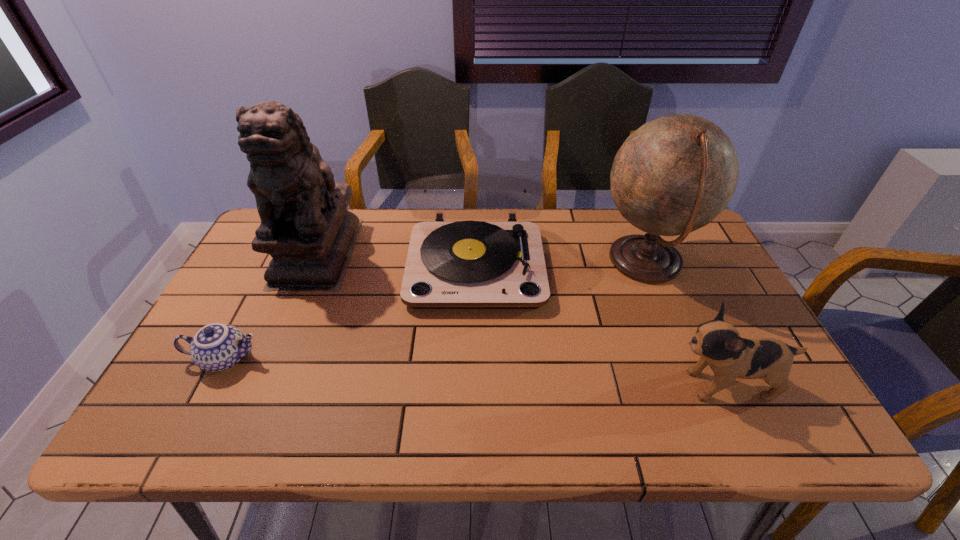
This screenshot has width=960, height=540. I want to click on chinaware at the left edge, so click(216, 347).

Image resolution: width=960 pixels, height=540 pixels. Identify the location of globe that is at the right edge. (675, 174).

What are the coordinates of `puppy that is at the right edge` in the screenshot? It's located at (x=718, y=343).

What are the coordinates of `object that is at the far left corner` in the screenshot? It's located at (305, 227).

Locate an element on the screen. This screenshot has width=960, height=540. object located at the far right corner is located at coordinates (675, 174).

The width and height of the screenshot is (960, 540). In order to click on object that is positioned at the near right corner in this screenshot , I will do click(x=718, y=343).

Locate an element on the screen. The width and height of the screenshot is (960, 540). vacant space at the far edge of the desktop is located at coordinates (608, 211).

At what (x,y) coordinates should I click in order to perform the action: click on free space at the left edge of the desktop. Please return your answer as a coordinate pair (x, y). The width and height of the screenshot is (960, 540). Looking at the image, I should click on (255, 322).

This screenshot has height=540, width=960. I want to click on free space at the far right corner, so click(x=691, y=254).

The image size is (960, 540). I want to click on vacant point located between the globe and the record player, so click(x=561, y=264).